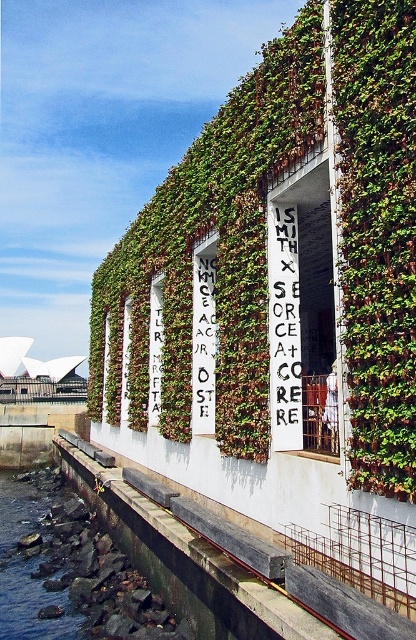
Is point (116, 280) positioned after point (289, 212)?

Yes, point (116, 280) is farther from viewer.

Is green leafy wall at center below black painted wood sign at center?

Indeed, green leafy wall at center is positioned under black painted wood sign at center.

At what (x,y) coordinates should I click in order to perform the action: click on green leafy wall at center. Please return your answer as a coordinate pair (x, y). This screenshot has height=640, width=416. Looking at the image, I should click on (215, 252).

Is black painted wood sign at center taller than white painted wood sign at center?

In fact, black painted wood sign at center may be shorter than white painted wood sign at center.

Is point (296, 384) more distant than point (192, 378)?

No, it is in front of (192, 378).

What do you see at coordinates (284, 326) in the screenshot? I see `black painted wood sign at center` at bounding box center [284, 326].

I want to click on black painted wood sign at center, so click(284, 326).

Who is taller, green leafy wall at center or white painted wood sign at center?

Standing taller between the two is green leafy wall at center.

From the picture: Between green leafy wall at center and white painted wood sign at center, which one is positioned lower?

green leafy wall at center is lower down.

You are a GUI agent. You are given a task and a screenshot of the screen. Output one action in this format:
    pyautogui.click(x=<x>, y=<y>)
    Task: Click on the green leafy wall at center
    This screenshot has height=640, width=416.
    Given the screenshot: What is the action you would take?
    pyautogui.click(x=215, y=252)

You are a GUI agent. You are given a task and a screenshot of the screen. Output one action in this format:
    pyautogui.click(x=<x>, y=<y>)
    Task: Click on the green leafy wall at center
    The image size is (416, 640).
    Given the screenshot: What is the action you would take?
    pyautogui.click(x=215, y=252)